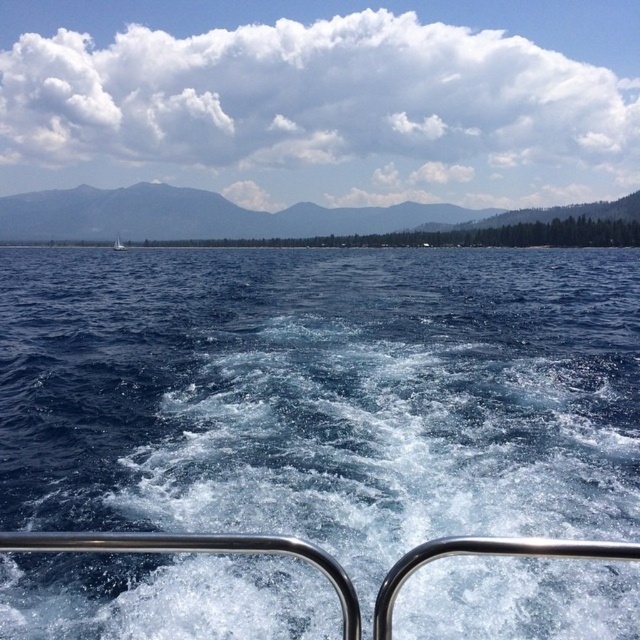
You are navigating a boat and want to know the exact coordinates of the blue liquid water at center in the image. What are its coordinates?

The blue liquid water at center is located at coordinates point (321, 394).

You are standing on the deck of the boat in the image. You see a point marked at coordinates point (243, 362). If you want to throw a lifebuoy to someone in the water who is exactly halfway between you and that point, how far in feet will the lifebuoy travel?

The distance between you and the point (243, 362) is 47.62 feet. Half of that distance is 23.81 feet, so the lifebuoy will travel 23.81 feet.